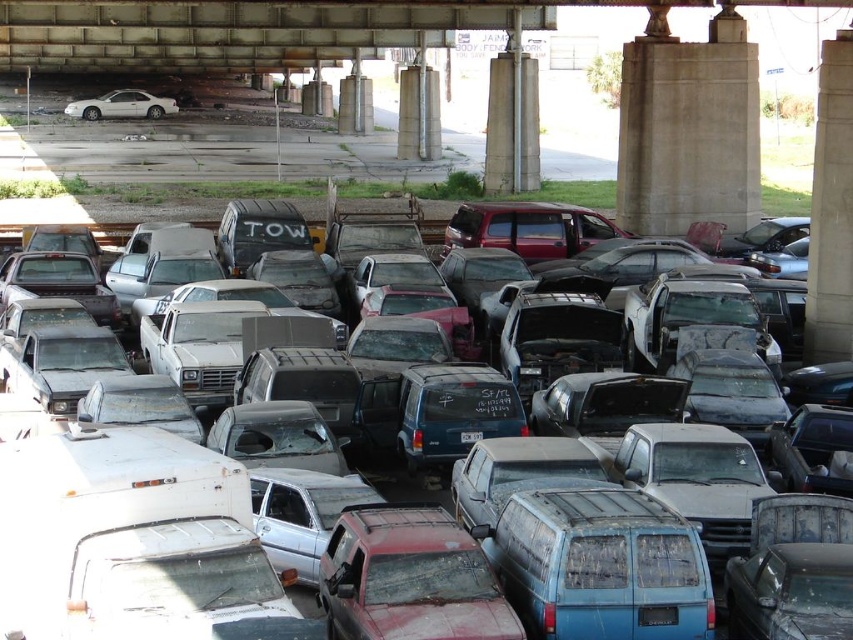
Who is taller, rusty metal truck at center or white glossy sedan at upper left?

With more height is rusty metal truck at center.

Who is lower down, rusty metal truck at center or white glossy sedan at upper left?

rusty metal truck at center is lower down.

Between point (767, 346) and point (138, 106), which one is positioned behind?

Positioned behind is point (138, 106).

Where is `rusty metal truck at center`? rusty metal truck at center is located at coordinates (704, 314).

Is point (109, 96) less distant than point (460, 438)?

No, it is behind (460, 438).

Can you confirm if white glossy sedan at upper left is positioned to the right of white plastic license plate at center?

Incorrect, white glossy sedan at upper left is not on the right side of white plastic license plate at center.

Is point (111, 104) closer to viewer compared to point (480, 435)?

No, (111, 104) is behind (480, 435).

This screenshot has width=853, height=640. What are the coordinates of `white glossy sedan at upper left` in the screenshot? It's located at (122, 106).

Is rusty metal truck at center positioned at the back of white plastic license plate at center?

No, it is in front of white plastic license plate at center.

How much distance is there between rusty metal truck at center and white plastic license plate at center?

rusty metal truck at center and white plastic license plate at center are 23.98 feet apart.

Locate an element on the screen. This screenshot has width=853, height=640. rusty metal truck at center is located at coordinates (704, 314).